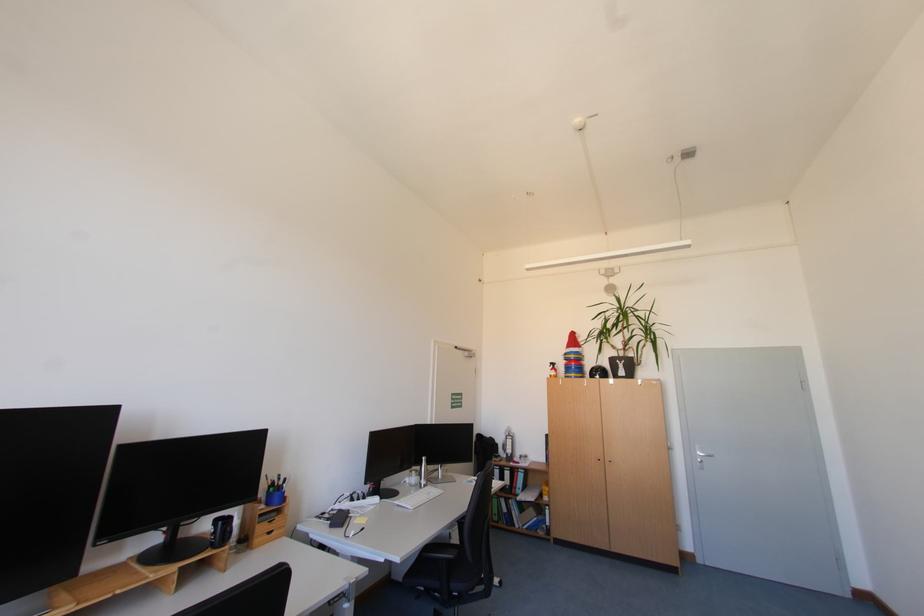
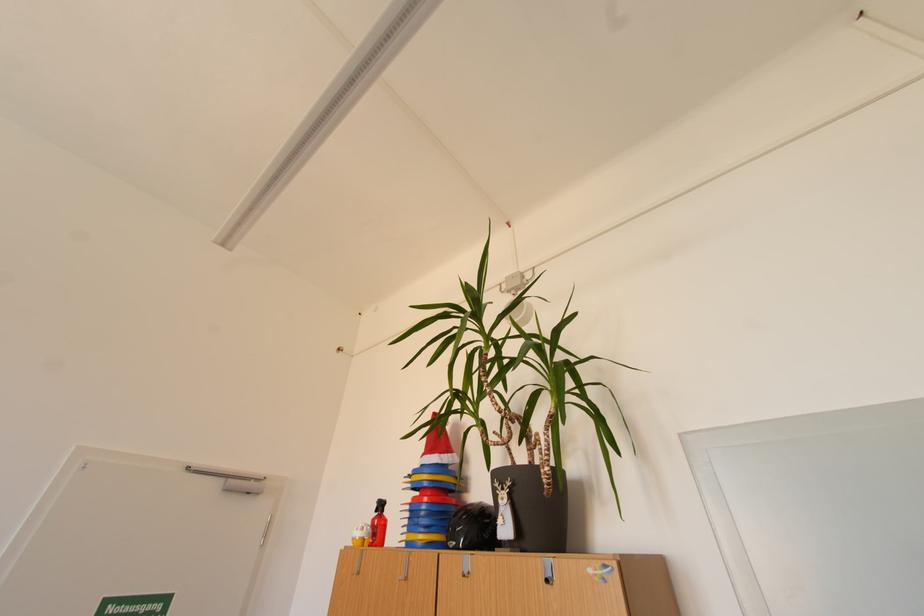
Locate, in the second image, the point that corresponds to the point at 581,369 in the first image.

(431, 514)